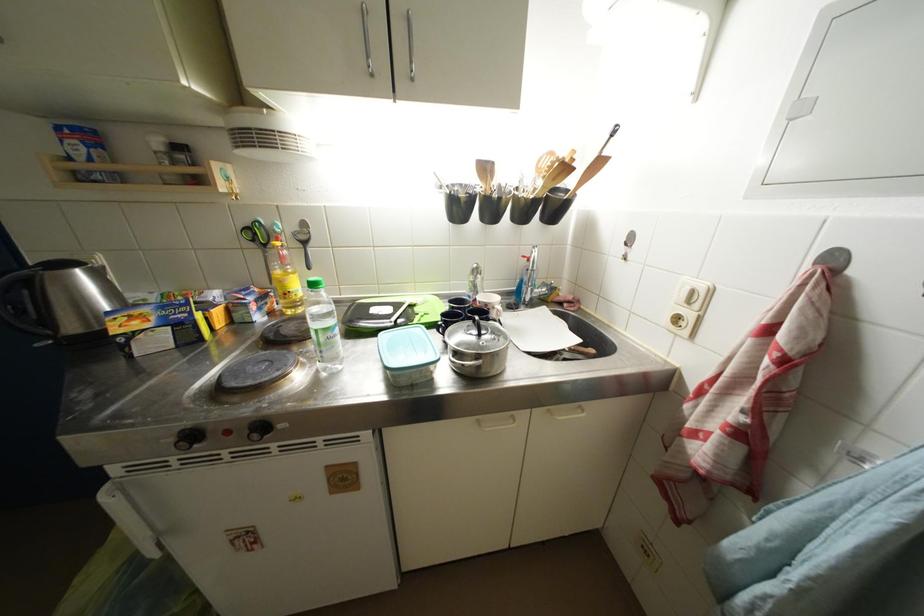
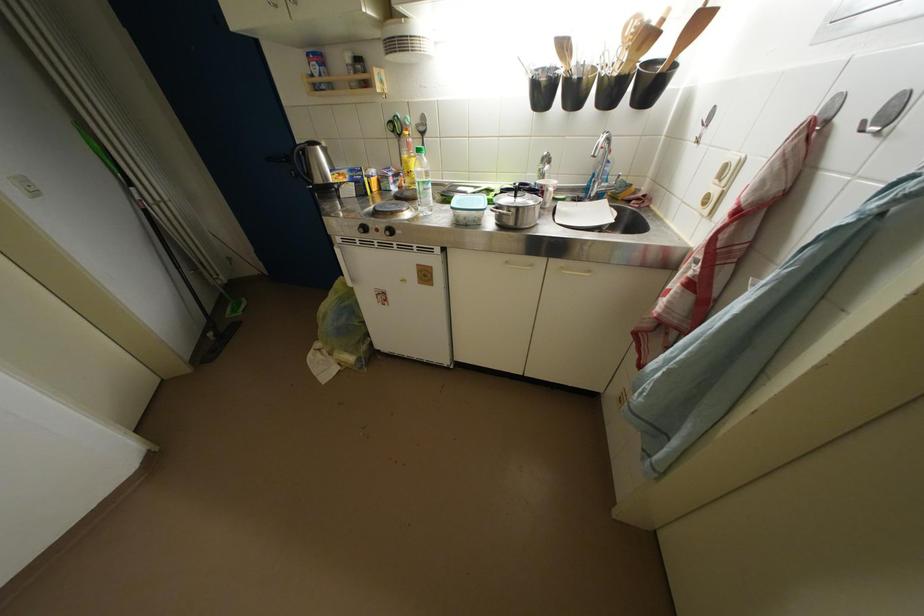
Locate, in the second image, the point that corresponds to pixel 272 249 in the first image.

(407, 140)